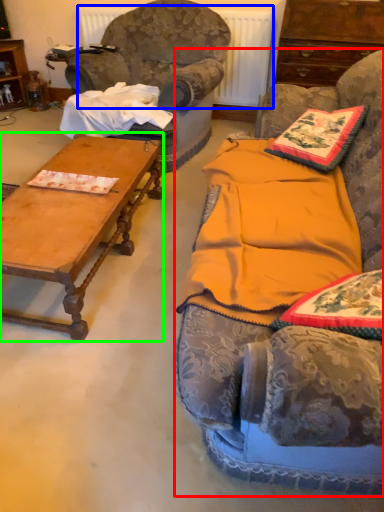
Question: Considering the real-world distances, which object is farthest from studio couch (highlighted by a red box)? radiator (highlighted by a blue box) or coffee table (highlighted by a green box)?

Choices:
 (A) radiator
 (B) coffee table

Answer: (A)